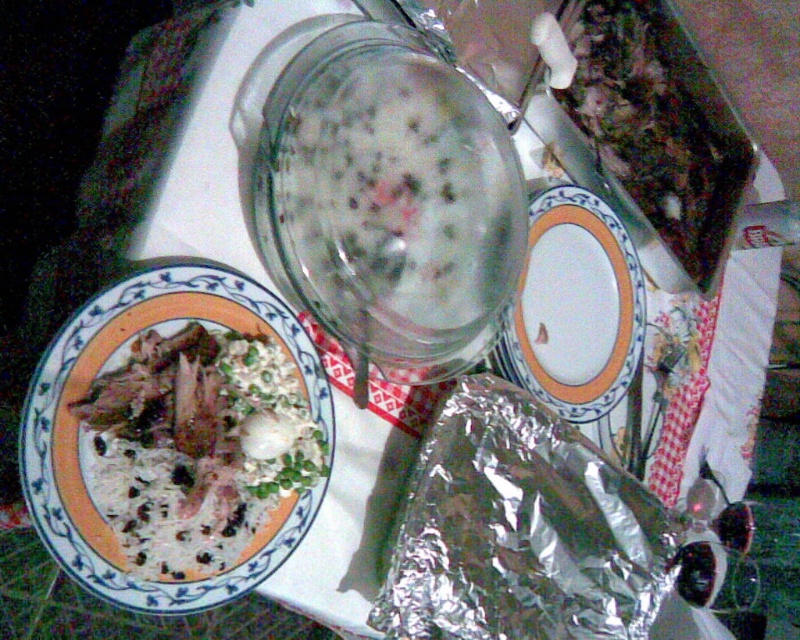
What is located at the coordinates point (526, 532)?

The coordinates point (526, 532) indicate the location of the shiny metallic foil at lower right.

You are a food critic who needs to reach the translucent glass jar at center to take a sample. There is a plate with orange and blue patterns in the foreground. Can you move the plate to access the jar?

The translucent glass jar at center is located at point (381, 195). Since the plate with orange and blue patterns is in the foreground, it might be blocking access to the jar. Moving the plate could allow you to reach the jar.

You are a guest at a dinner party and you want to pour some sauce from the translucent glass jar at center into the white matte rice bowl at left. Is the jar large enough to hold the entire contents of the bowl?

The translucent glass jar at center has a larger size compared to white matte rice bowl at left, so yes, the jar can hold the entire contents of the white matte rice bowl at left.